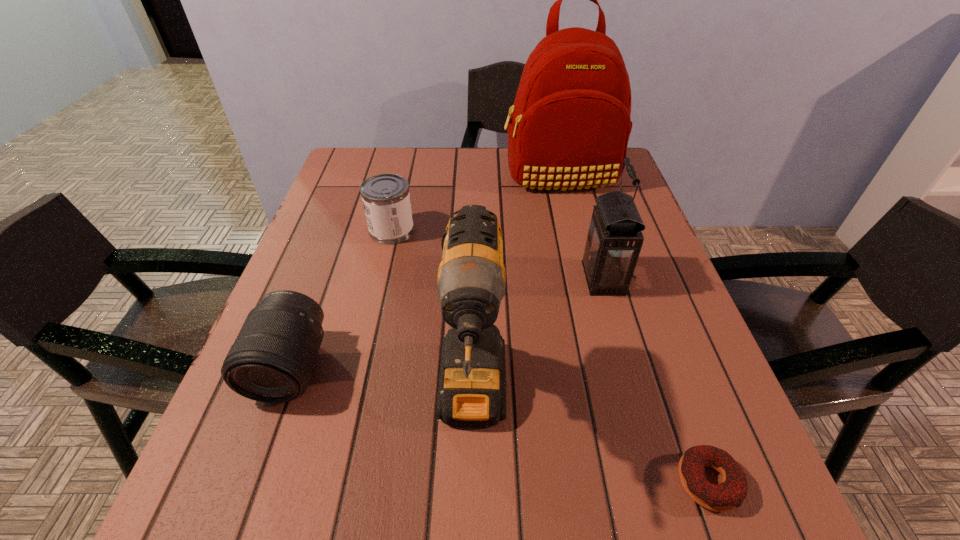
Where is `free space located 0.230m on the front-facing side of the tallest object`? free space located 0.230m on the front-facing side of the tallest object is located at coordinates (579, 253).

Find the location of a particular element. This screenshot has height=540, width=960. vacant area located with the drill bit of the third object from left to right facing forward is located at coordinates (470, 536).

Identify the location of vacant space situated on the front-facing side of the lantern. (477, 278).

The width and height of the screenshot is (960, 540). In order to click on vacant area situated 0.290m on the front-facing side of the lantern in this screenshot , I will do `click(450, 278)`.

The width and height of the screenshot is (960, 540). Find the location of `vacant space located on the front-facing side of the lantern`. vacant space located on the front-facing side of the lantern is located at coordinates (527, 278).

Identify the location of vacant position located on the surface of the telephoto lens. (263, 442).

You are a GUI agent. You are given a task and a screenshot of the screen. Output one action in this format:
    pyautogui.click(x=<x>, y=<y>)
    Task: Click on the vacant space positioned on the front of the second object from left to right
    
    Given the screenshot: What is the action you would take?
    pyautogui.click(x=381, y=277)

Find the location of a particular element. The image size is (960, 540). free location located on the back of the doughnut is located at coordinates (681, 405).

Where is `object that is at the far edge`? The image size is (960, 540). object that is at the far edge is located at coordinates (570, 126).

What are the coordinates of `object present at the near edge` in the screenshot? It's located at (731, 492).